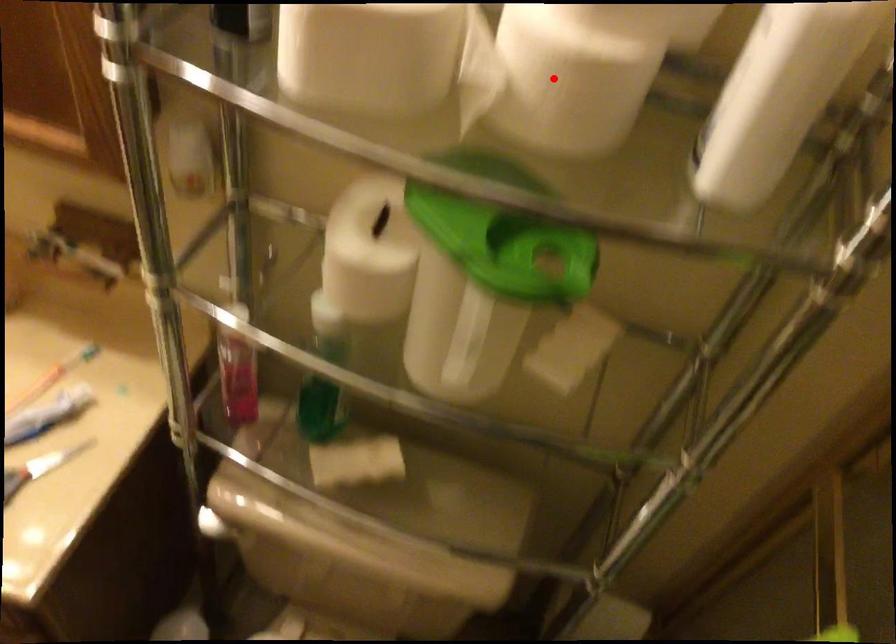
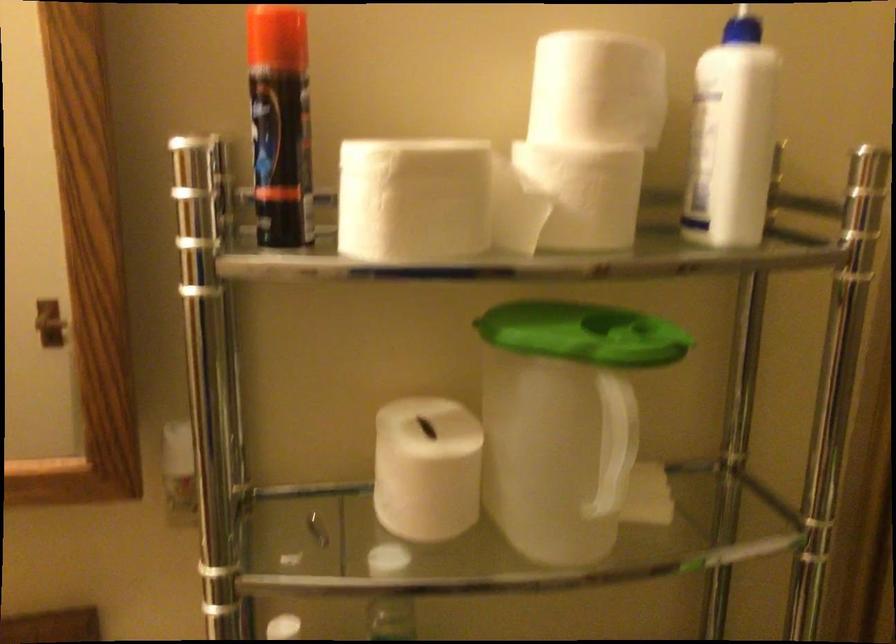
Question: I am providing you with two images of the same scene from different viewpoints. A red point is shown in image1. For the corresponding object point in image2, is it positioned nearer or farther from the camera?

Choices:
 (A) Nearer
 (B) Farther

Answer: (B)